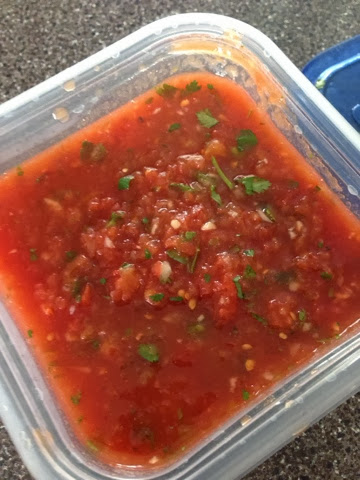
At what (x,y) coordinates should I click in order to perform the action: click on rim of tub. Please return your answer as a coordinate pair (x, y). This screenshot has height=480, width=360. Looking at the image, I should click on pyautogui.click(x=299, y=413).